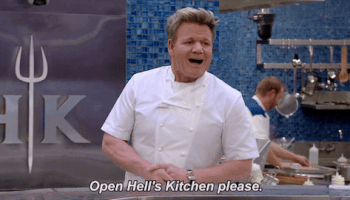
Where is `rack where pans and utensils are hanging`? The height and width of the screenshot is (200, 350). rack where pans and utensils are hanging is located at coordinates coord(301,58).